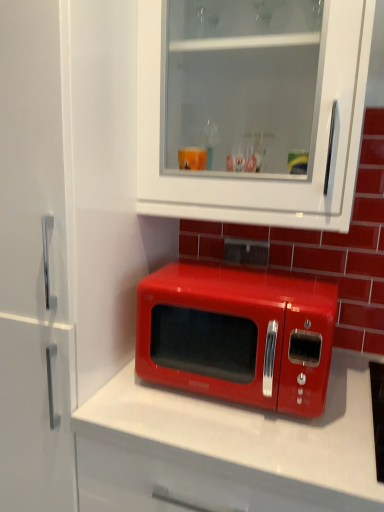
This screenshot has height=512, width=384. What do you see at coordinates (237, 335) in the screenshot? I see `glossy red microwave at center` at bounding box center [237, 335].

Find the location of `glossy red microwave at center`. glossy red microwave at center is located at coordinates (237, 335).

Identify the location of white glossy cabinet at upper center. (251, 109).

What do you see at coordinates (251, 109) in the screenshot? I see `white glossy cabinet at upper center` at bounding box center [251, 109].

From the picture: In order to face white glossy cabinet at upper center, should I rotate leftwards or rightwards?

Rotate right and turn 8.395 degrees.

Where is `glossy red microwave at center`? glossy red microwave at center is located at coordinates (237, 335).

Considering the relative positions of white glossy cabinet at upper center and glossy red microwave at center in the image provided, is white glossy cabinet at upper center to the left of glossy red microwave at center from the viewer's perspective?

Incorrect, white glossy cabinet at upper center is not on the left side of glossy red microwave at center.

Which is behind, white glossy cabinet at upper center or glossy red microwave at center?

glossy red microwave at center is further from the camera.

Is point (343, 83) farther from camera compared to point (266, 275)?

No, (343, 83) is closer to viewer.

From the image's perspective, does white glossy cabinet at upper center appear higher than glossy red microwave at center?

Indeed, from the image's perspective, white glossy cabinet at upper center is shown above glossy red microwave at center.

From a real-world perspective, is white glossy cabinet at upper center positioned above or below glossy red microwave at center?

From a real-world perspective, white glossy cabinet at upper center is physically above glossy red microwave at center.

Looking at this image, can you confirm if white glossy cabinet at upper center is wider than glossy red microwave at center?

No, white glossy cabinet at upper center is not wider than glossy red microwave at center.

Looking at this image, which of these two, white glossy cabinet at upper center or glossy red microwave at center, stands shorter?

glossy red microwave at center is shorter.

Is white glossy cabinet at upper center bigger than glossy red microwave at center?

Yes.

Is white glossy cabinet at upper center spatially inside glossy red microwave at center, or outside of it?

white glossy cabinet at upper center exists outside the volume of glossy red microwave at center.

Is white glossy cabinet at upper center in contact with glossy red microwave at center?

white glossy cabinet at upper center and glossy red microwave at center are not in contact.

Is white glossy cabinet at upper center facing away from glossy red microwave at center?

white glossy cabinet at upper center is not turned away from glossy red microwave at center.

How many degrees apart are the facing directions of white glossy cabinet at upper center and glossy red microwave at center?

The facing directions of white glossy cabinet at upper center and glossy red microwave at center are 0.000183 degrees apart.

This screenshot has width=384, height=512. In the image, there is a glossy red microwave at center. Identify the location of cabinetry above it (from the image's perspective). (251, 109).

Considering the relative positions of glossy red microwave at center and white glossy cabinet at upper center in the image provided, is glossy red microwave at center to the right of white glossy cabinet at upper center from the viewer's perspective?

No.

Is the position of glossy red microwave at center more distant than that of white glossy cabinet at upper center?

Yes, it is.

Between point (315, 372) and point (200, 101), which one is positioned behind?

The point (200, 101) is farther.

From the image's perspective, relative to white glossy cabinet at upper center, is glossy red microwave at center above or below?

From the image's perspective, glossy red microwave at center appears below white glossy cabinet at upper center.

From a real-world perspective, which object rests below the other?

In real-world perspective, glossy red microwave at center is lower.

Is glossy red microwave at center thinner than white glossy cabinet at upper center?

In fact, glossy red microwave at center might be wider than white glossy cabinet at upper center.

Is glossy red microwave at center shorter than white glossy cabinet at upper center?

Correct, glossy red microwave at center is not as tall as white glossy cabinet at upper center.

Who is bigger, glossy red microwave at center or white glossy cabinet at upper center?

white glossy cabinet at upper center is bigger.

Choose the correct answer: Is glossy red microwave at center inside white glossy cabinet at upper center or outside it?

glossy red microwave at center is spatially situated outside white glossy cabinet at upper center.

Is the surface of glossy red microwave at center in direct contact with white glossy cabinet at upper center?

They are not placed beside each other.

Is glossy red microwave at center positioned with its back to white glossy cabinet at upper center?

No, glossy red microwave at center is not facing away from white glossy cabinet at upper center.

At what (x,y) coordinates should I click in order to perform the action: click on microwave oven below the white glossy cabinet at upper center (from a real-world perspective). Please return your answer as a coordinate pair (x, y). Looking at the image, I should click on (237, 335).

You are a GUI agent. You are given a task and a screenshot of the screen. Output one action in this format:
    pyautogui.click(x=<x>, y=<y>)
    Task: Click on the microwave oven behind the white glossy cabinet at upper center
    
    Given the screenshot: What is the action you would take?
    pyautogui.click(x=237, y=335)

The image size is (384, 512). Identify the location of cabinetry above the glossy red microwave at center (from the image's perspective). (251, 109).